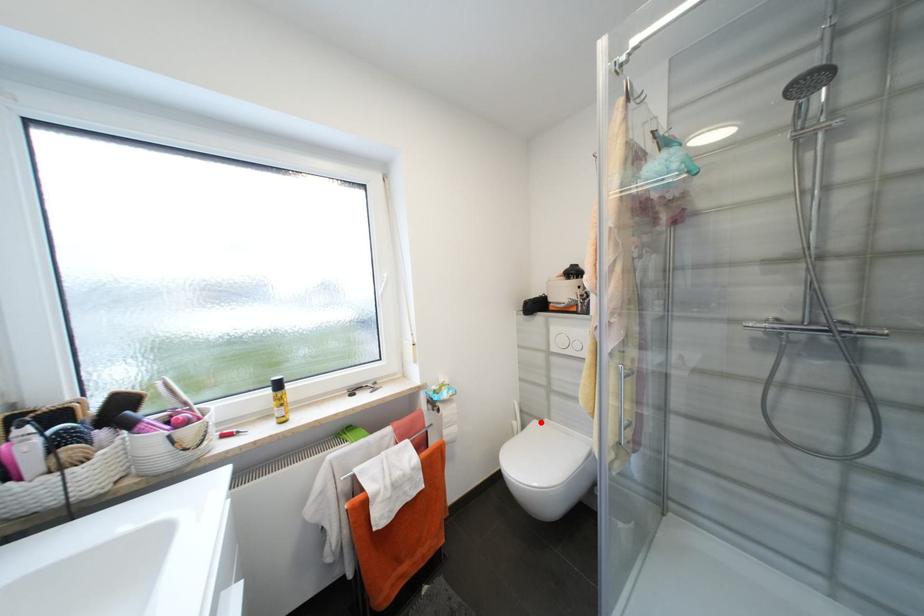
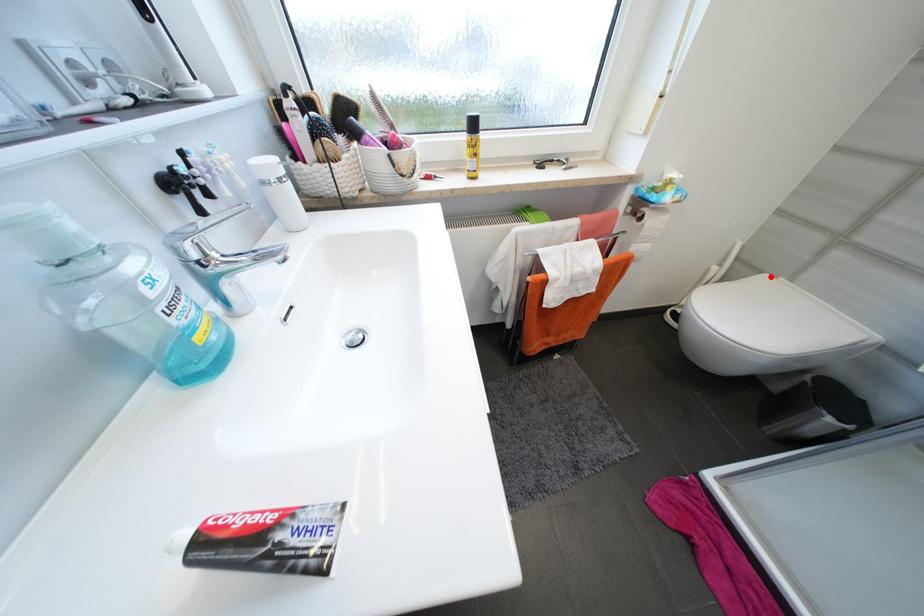
I am providing you with two images of the same scene from different viewpoints. A red point is marked on the first image and another point is marked on the second image. Do the highlighted points in image1 and image2 indicate the same real-world spot?

Yes